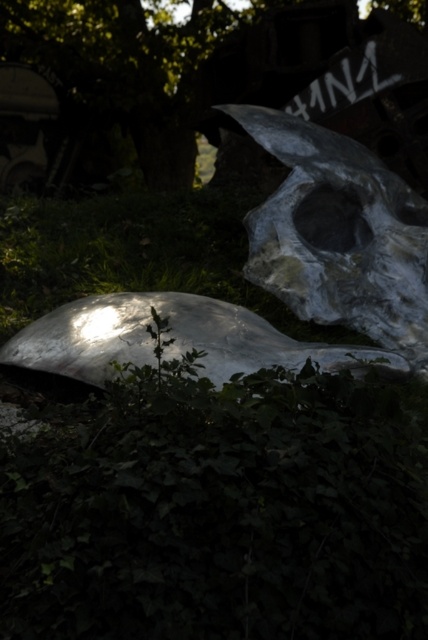
You are standing in the outdoor area looking at the green leafy tree at center. If you want to walk towards it, how many steps would you need to take if each step is approximately 3 feet long?

The green leafy tree at center is 25.80 feet away from you. Since each step is about 3 feet, you would need to take 25.80 divided by 3, which equals approximately 8.6 steps. Since you can only take whole steps, you would need to take 9 steps to reach the green leafy tree at center.

Looking at this image, you are a landscape architect designing a pathway between the green leafy tree at center and the metallic gray skull at upper right. Given their distance apart, what is the minimum length of the pathway required to connect them directly?

The green leafy tree at center and metallic gray skull at upper right are 20.73 feet apart, so the minimum length of the pathway required to connect them directly is 20.73 feet.